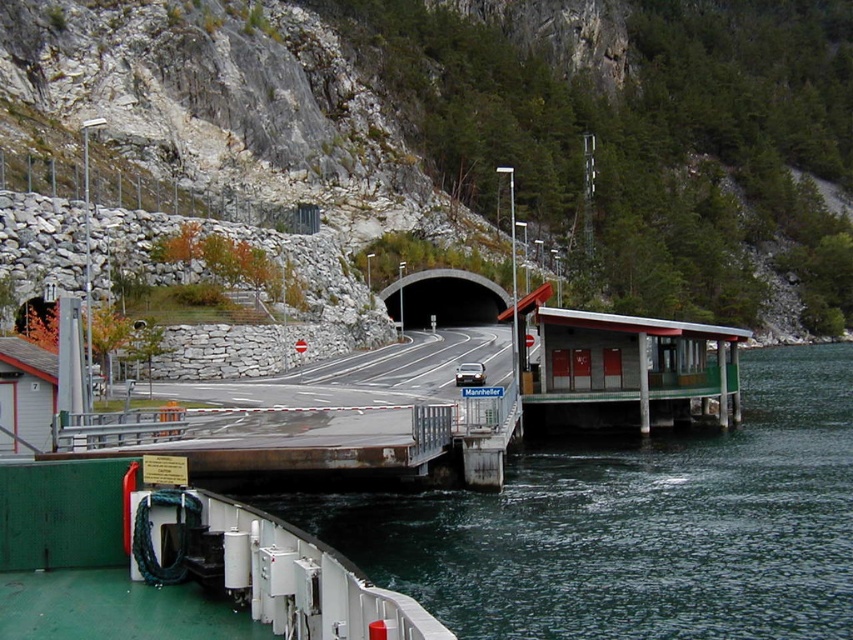
You are standing on the ferry and see the dark blue water at lower center and the black concrete tunnel at center. Which object is located to the right when facing the scene?

The dark blue water at lower center is to the right of the black concrete tunnel at center, so the dark blue water at lower center is located to the right when facing the scene.

You are a photographer planning to capture the coastal road scene. You want to ensure that the dark blue water at lower center and the black concrete tunnel at center are both visible in your shot. Based on their sizes, which object should you prioritize framing closer to the edge of the photo to avoid overcrowding?

The dark blue water at lower center has a larger width than the black concrete tunnel at center. To avoid overcrowding, prioritize framing the larger dark blue water at lower center closer to the edge of the photo.

You are a delivery drone that needs to fly from the dark blue water at lower center to the black concrete tunnel at center. What is the minimum distance you must cover to reach your destination?

The minimum distance you must cover to reach the black concrete tunnel at center from the dark blue water at lower center is 59.45 meters.